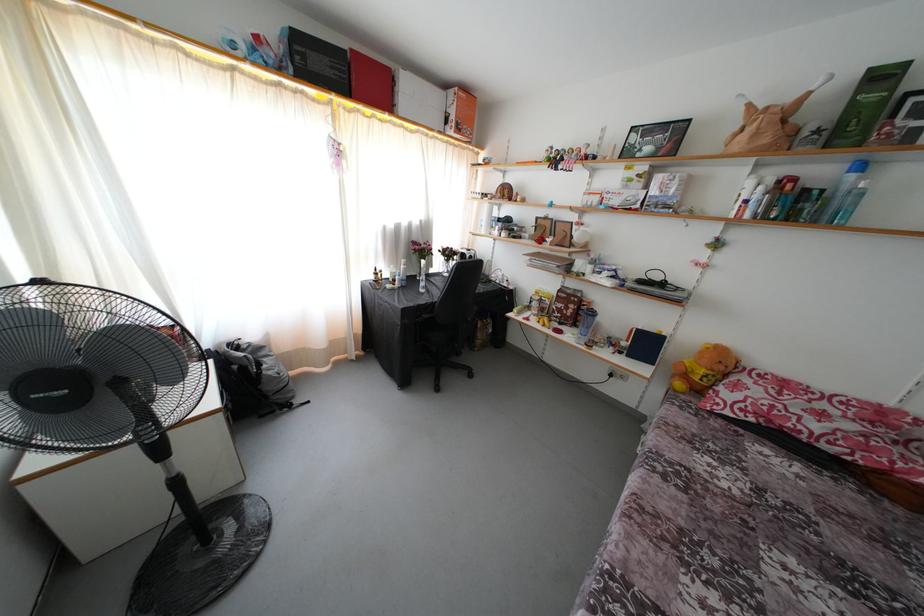
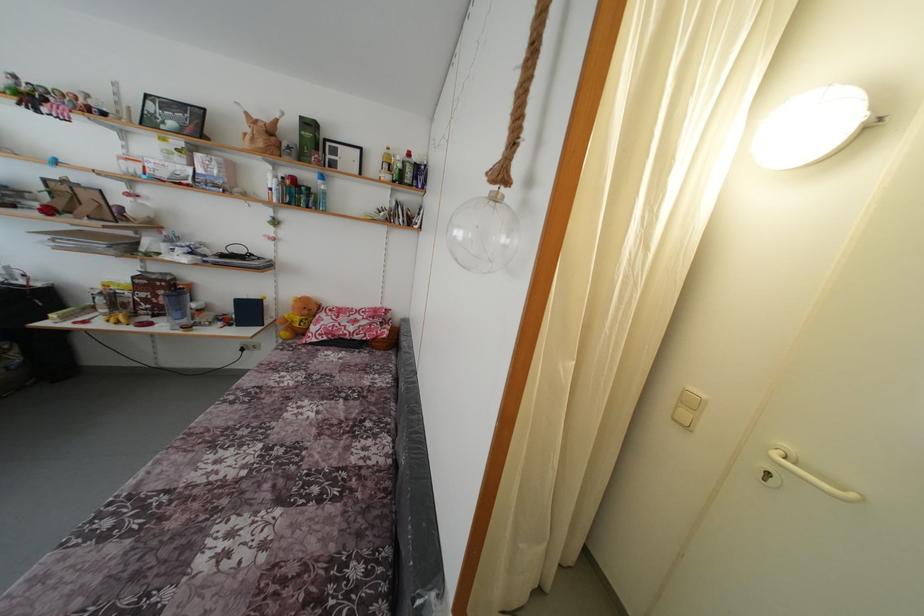
The point at (545, 315) is marked in the first image. Where is the corresponding point in the second image?

(120, 310)